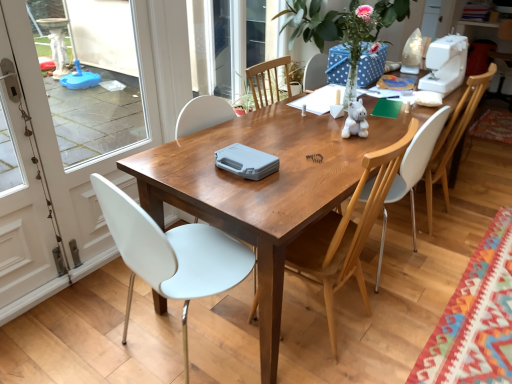
Locate an element on the screen. vacant area located to the right-hand side of white plastic chair at center, the third chair when ordered from left to right is located at coordinates (434, 253).